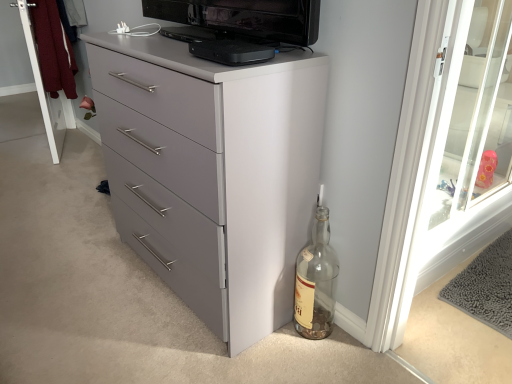
Image resolution: width=512 pixels, height=384 pixels. Identify the location of free location in front of matte gray chest of drawers at center. (175, 349).